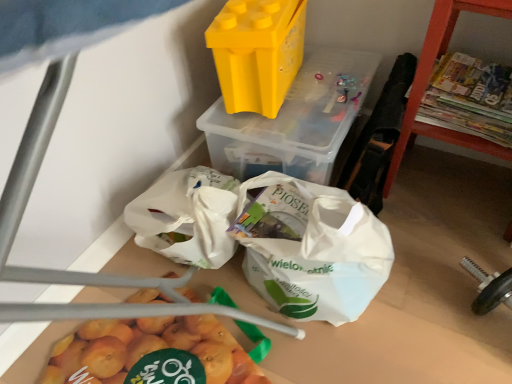
Question: In the image, is yellow plastic container at upper center, acting as the second yoghurt starting from the right, on the left side or the right side of yellow plastic container at upper center, the second yoghurt in the left-to-right sequence?

Choices:
 (A) right
 (B) left

Answer: (B)

Question: From a real-world perspective, is yellow plastic container at upper center, marked as the first yoghurt in a left-to-right arrangement, physically located above or below yellow plastic container at upper center, which is the 1th yoghurt from right to left?

Choices:
 (A) above
 (B) below

Answer: (A)

Question: Estimate the real-world distances between objects in this image. Which object is farther from the orange wood shelf at right?

Choices:
 (A) yellow plastic container at upper center, the second yoghurt in the left-to-right sequence
 (B) yellow plastic container at upper center, marked as the first yoghurt in a left-to-right arrangement

Answer: (B)

Question: Based on their relative distances, which object is farther from the orange wood shelf at right?

Choices:
 (A) yellow plastic container at upper center, acting as the second yoghurt starting from the right
 (B) yellow plastic container at upper center, which is the 1th yoghurt from right to left

Answer: (A)